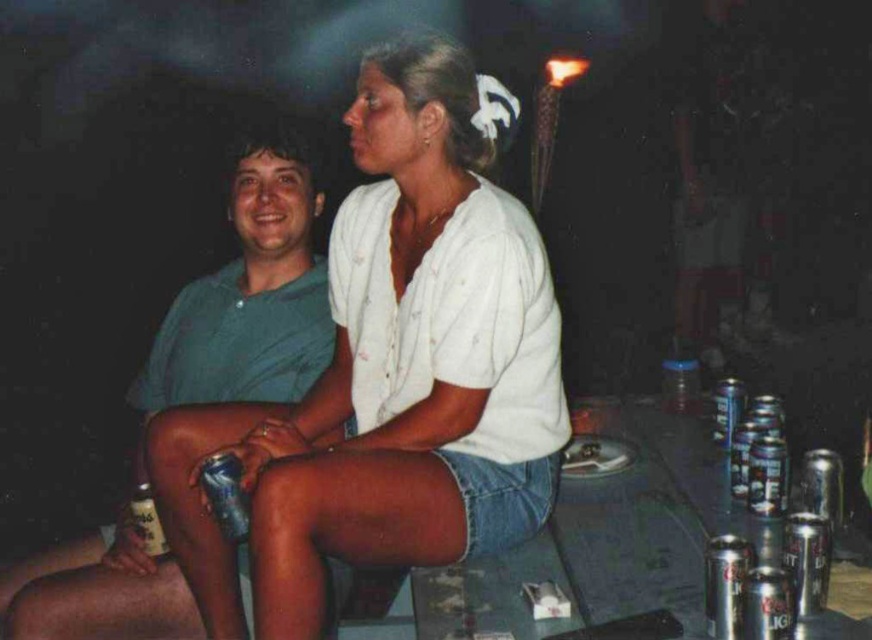
Between white cotton shirt at center and green matte shirt at left, which one is positioned higher?

white cotton shirt at center

Is point (341, 493) closer to camera compared to point (261, 173)?

That is True.

Which is in front, point (394, 163) or point (243, 148)?

Positioned in front is point (394, 163).

Locate an element on the screen. This screenshot has height=640, width=872. white cotton shirt at center is located at coordinates (390, 372).

Is white cotton shirt at center further to camera compared to silver metallic can at lower left?

No, it is not.

Consider the image. Can you confirm if white cotton shirt at center is positioned to the left of silver metallic can at lower left?

In fact, white cotton shirt at center is to the right of silver metallic can at lower left.

Find the location of a particular element. white cotton shirt at center is located at coordinates (390, 372).

Does point (117, 624) come farther from viewer compared to point (225, 474)?

Yes, it is.

Which is in front, point (80, 620) or point (246, 524)?

Point (246, 524) is in front.

Where is `green matte shirt at left`? The image size is (872, 640). green matte shirt at left is located at coordinates (250, 296).